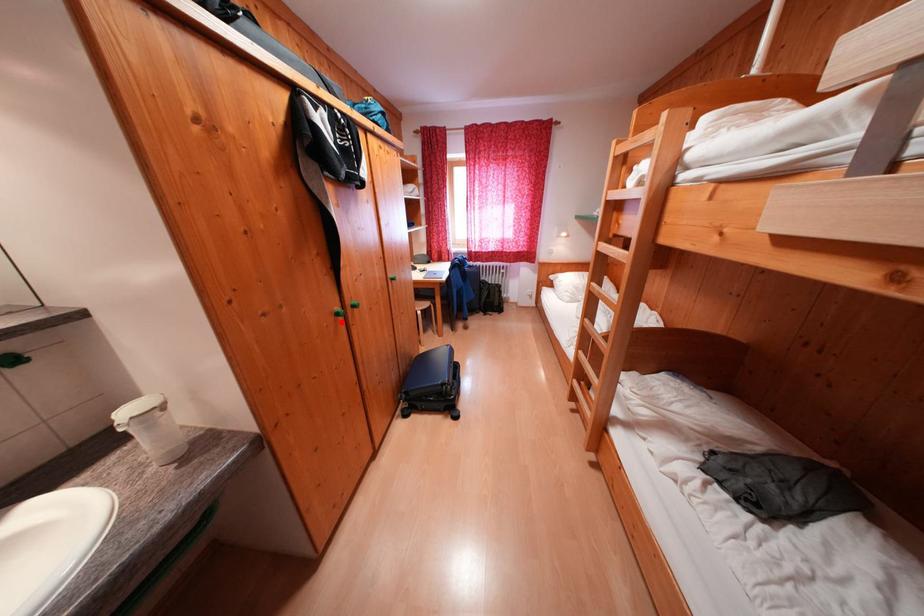
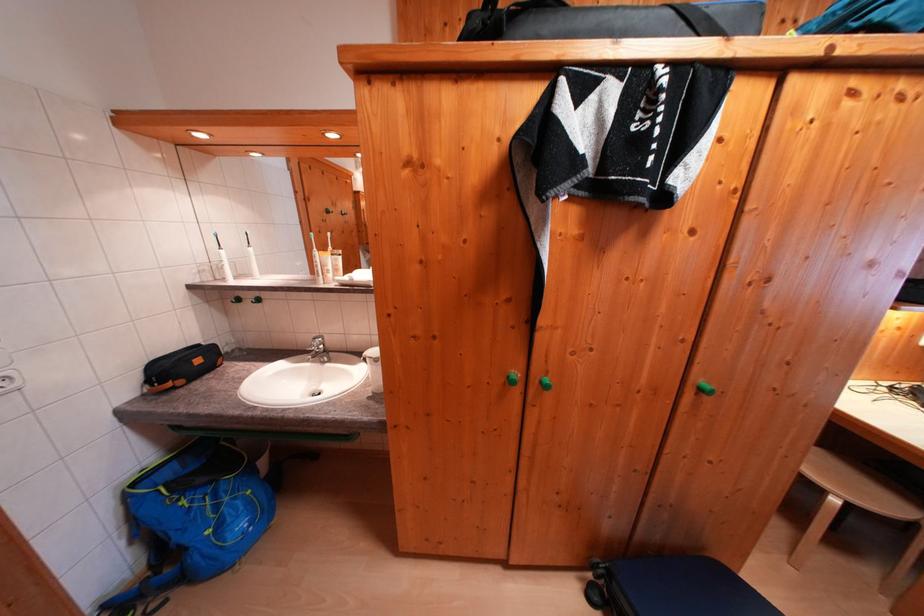
In the second image, find the point that corresponds to the highlighted location in the first image.

(511, 384)